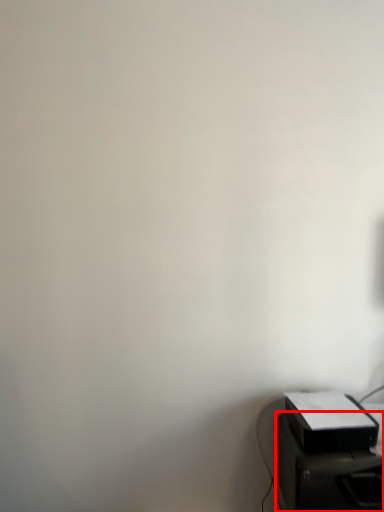
Question: Considering the relative positions of furniture (annotated by the red box) and printer in the image provided, where is furniture (annotated by the red box) located with respect to the staircase?

Choices:
 (A) right
 (B) left

Answer: (A)